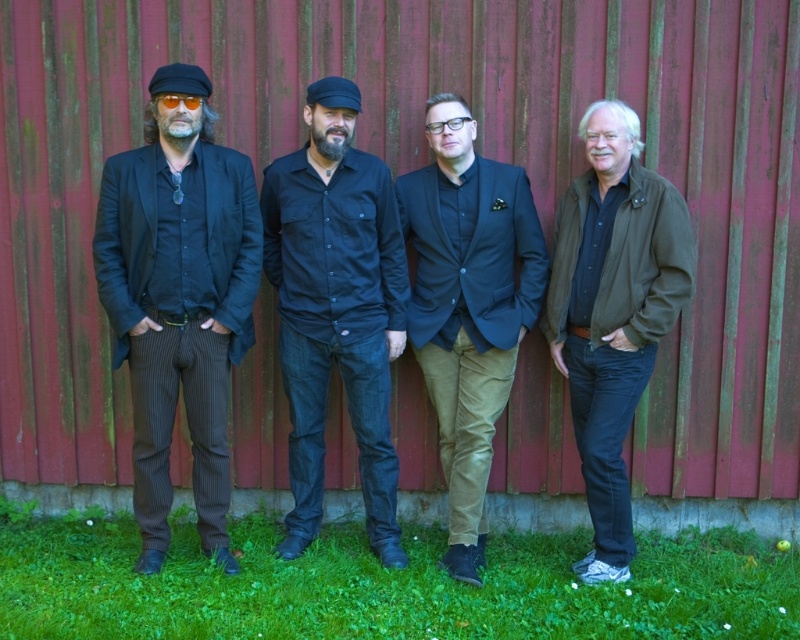
Question: Considering the real-world distances, which object is closest to the dark brown leather jacket at right?

Choices:
 (A) matte black blazer at center
 (B) black denim jeans at center

Answer: (A)

Question: Can you confirm if dark brown leather jacket at right is positioned above matte black blazer at center?

Choices:
 (A) no
 (B) yes

Answer: (A)

Question: Estimate the real-world distances between objects in this image. Which object is farther from the dark brown leather jacket at right?

Choices:
 (A) matte black blazer at center
 (B) black pinstripe suit at left

Answer: (B)

Question: Observing the image, what is the correct spatial positioning of black pinstripe suit at left in reference to dark brown leather jacket at right?

Choices:
 (A) below
 (B) above

Answer: (B)

Question: Does black denim jeans at center have a lesser width compared to dark brown leather jacket at right?

Choices:
 (A) no
 (B) yes

Answer: (A)

Question: Which object is closer to the camera taking this photo?

Choices:
 (A) black pinstripe suit at left
 (B) dark brown leather jacket at right
 (C) black denim jeans at center

Answer: (A)